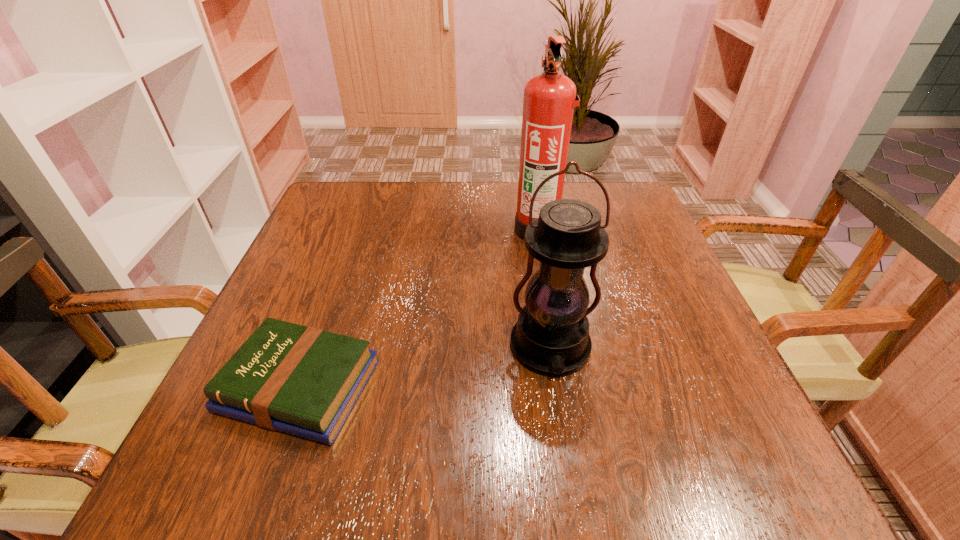
At what (x,y) coordinates should I click in order to perform the action: click on free location that satisfies the following two spatial constraints: 1. with the nozzle pointing from the back of the tallest object; 2. on the front side of the shortest object. Please return your answer as a coordinate pair (x, y). The height and width of the screenshot is (540, 960). Looking at the image, I should click on (564, 386).